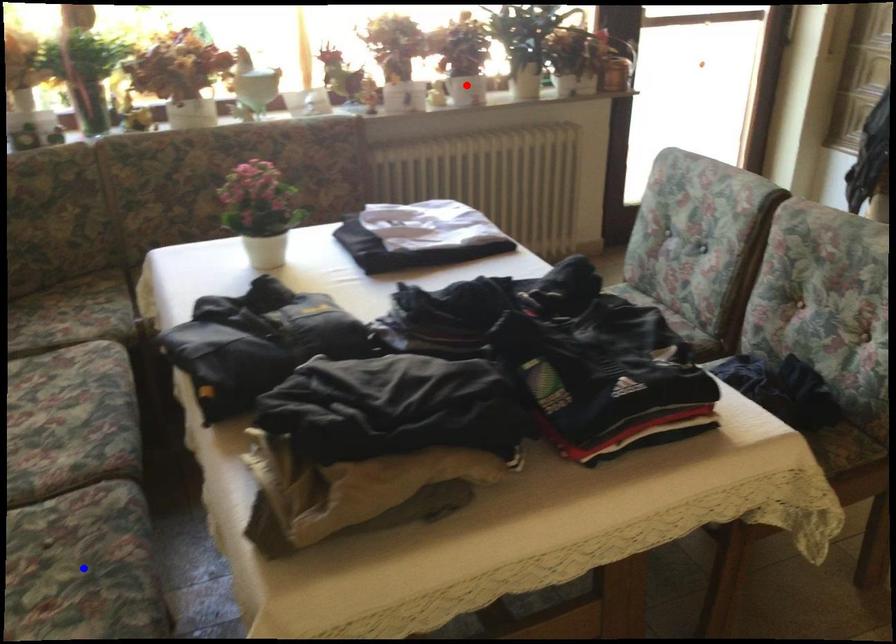
Question: Which of the two points in the image is closer to the camera?

Choices:
 (A) Blue point is closer.
 (B) Red point is closer.

Answer: (A)